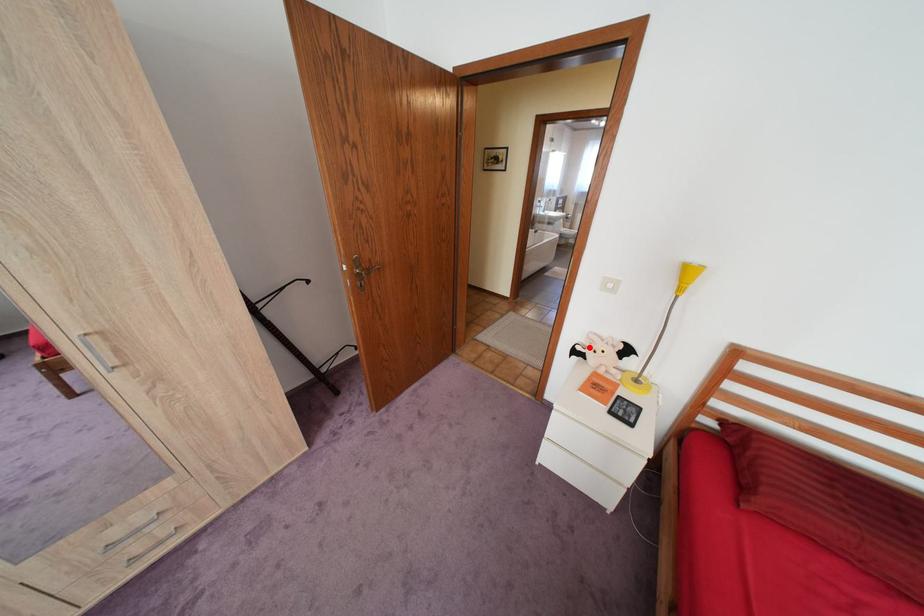
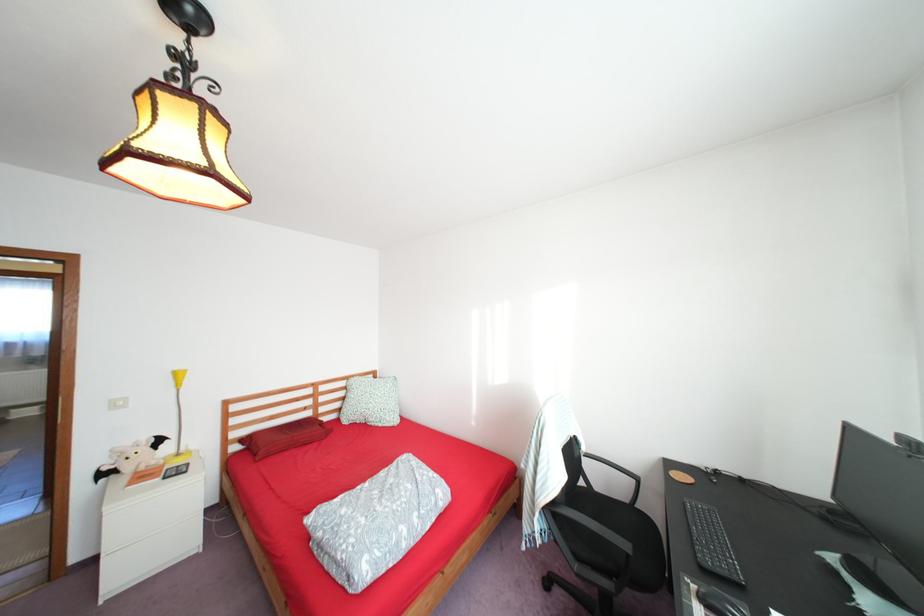
Question: I am providing you with two images of the same scene from different viewpoints. Given a red point in image1, look at the same physical point in image2. Is it:

Choices:
 (A) Closer to the viewpoint
 (B) Farther from the viewpoint

Answer: (A)